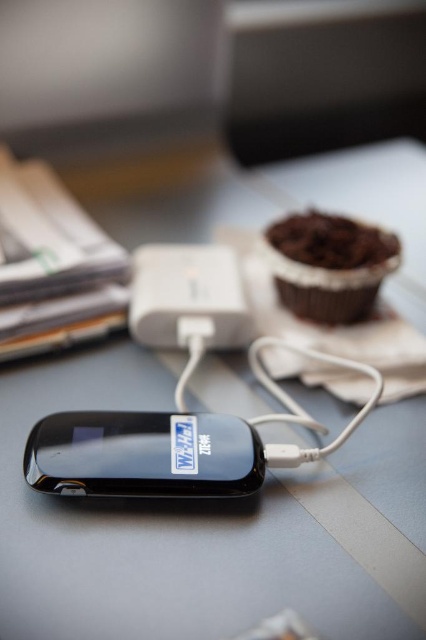
You are a delivery person who needs to place a small package on the desk in the image. The package must be placed at coordinates point [328,264]. What object is located at this point?

The point [328,264] marks the location of the chocolate cake at upper right.

You are organizing items on a desk and need to place a new item between the black glossy smartphone at center and the chocolate cake at upper right. Where should you position it to ensure it is between them?

The black glossy smartphone at center is located below the chocolate cake at upper right, so placing the new item between them would require positioning it above the smartphone and below the cake.

You are a photographer trying to capture a clear photo of the black glossy smartphone at center using a camera. The camera requires a minimum distance of 36 inches to focus properly. Based on the scene, will the camera be able to focus on the smartphone?

The black glossy smartphone at center and camera are 36.77 inches apart from each other, which is just over the 36 inches minimum distance required. Therefore, the camera should be able to focus on the smartphone.